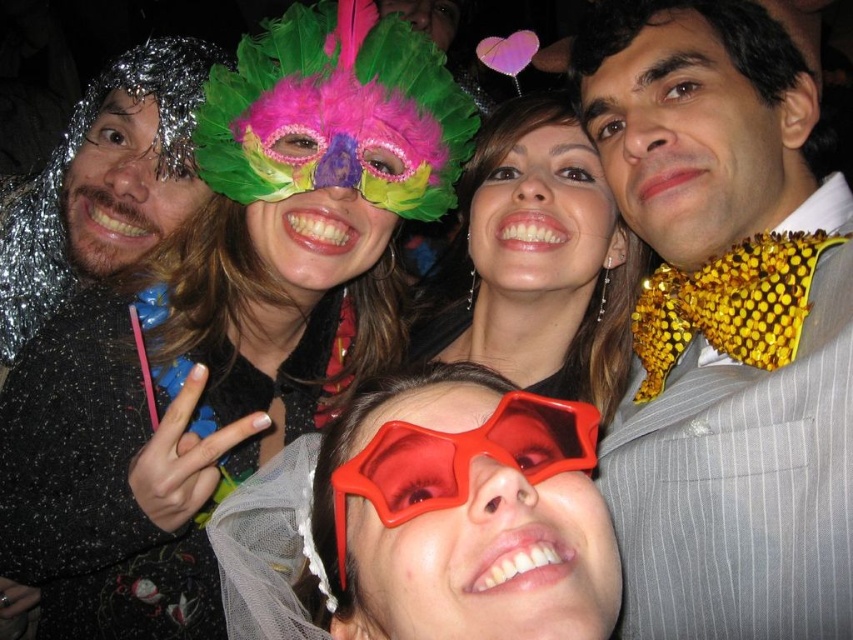
Does shiny gold bow tie at center have a lesser width compared to transparent plastic glasses at center?

Yes.

Which is behind, point (640, 380) or point (430, 509)?

The point (640, 380) is more distant.

Does point (666, 490) come behind point (297, 580)?

No, (666, 490) is closer to viewer.

The height and width of the screenshot is (640, 853). Identify the location of shiny gold bow tie at center. (724, 324).

Identify the location of matte black dress at center. (534, 262).

Which is below, matte black dress at center or shiny metallic foil at left?

matte black dress at center

You are a GUI agent. You are given a task and a screenshot of the screen. Output one action in this format:
    pyautogui.click(x=<x>, y=<y>)
    Task: Click on the matte black dress at center
    
    Given the screenshot: What is the action you would take?
    pyautogui.click(x=534, y=262)

How far apart are black sequined dress at upper left and matte black dress at center?

black sequined dress at upper left and matte black dress at center are 19.53 inches apart from each other.

Can you confirm if black sequined dress at upper left is bigger than matte black dress at center?

Actually, black sequined dress at upper left might be smaller than matte black dress at center.

The image size is (853, 640). Find the location of `black sequined dress at upper left`. black sequined dress at upper left is located at coordinates (93, 486).

Where is `black sequined dress at upper left`? black sequined dress at upper left is located at coordinates (93, 486).